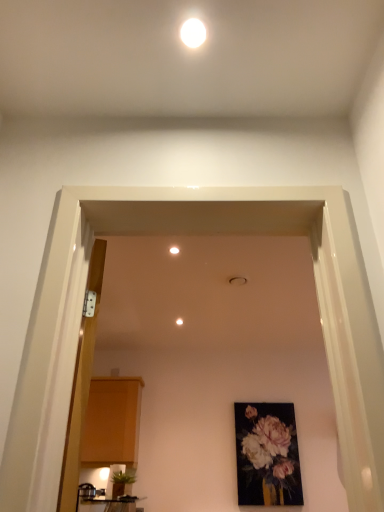
The width and height of the screenshot is (384, 512). Describe the element at coordinates (107, 504) in the screenshot. I see `matte black table at lower left` at that location.

Describe the element at coordinates (267, 455) in the screenshot. Image resolution: width=384 pixels, height=512 pixels. I see `matte floral painting at center` at that location.

Where is `white glossy light fixture at upper center, which is the 1th lighting from front to back`? The image size is (384, 512). white glossy light fixture at upper center, which is the 1th lighting from front to back is located at coordinates (193, 32).

From the picture: How different are the orientations of white matte ceiling light at center, the first lighting positioned from the left, and wooden door at left in degrees?

They differ by 69.7 degrees in their facing directions.

I want to click on door to the left of white matte ceiling light at center, the first lighting positioned from the left, so click(x=81, y=386).

Considering the sizes of white matte ceiling light at center, which appears as the second lighting when viewed from the right, and wooden door at left in the image, is white matte ceiling light at center, which appears as the second lighting when viewed from the right, bigger or smaller than wooden door at left?

white matte ceiling light at center, which appears as the second lighting when viewed from the right, is smaller than wooden door at left.

From a real-world perspective, which object stands above the other?

matte wood cabinet at left is physically above.

Identify the location of cabinetry that appears on the left of matte black table at lower left. The width and height of the screenshot is (384, 512). (112, 422).

Does matte black table at lower left have a smaller size compared to matte wood cabinet at left?

Correct, matte black table at lower left occupies less space than matte wood cabinet at left.

Is green leafy plant at lower left looking in the opposite direction of wooden door at left?

That's not correct — green leafy plant at lower left is not looking away from wooden door at left.

From the image's perspective, who appears lower, green leafy plant at lower left or wooden door at left?

From the image's view, green leafy plant at lower left is below.

In the scene shown: Who is taller, green leafy plant at lower left or wooden door at left?

wooden door at left is taller.

Visually, is green leafy plant at lower left positioned to the left or to the right of wooden door at left?

Based on their positions, green leafy plant at lower left is located to the right of wooden door at left.

From the picture: Is matte floral painting at center to the left of matte black table at lower left from the viewer's perspective?

Incorrect, matte floral painting at center is not on the left side of matte black table at lower left.

Is matte floral painting at center positioned beyond the bounds of matte black table at lower left?

Yes, matte floral painting at center is not within matte black table at lower left.

Between matte floral painting at center and matte black table at lower left, which one has less height?

matte black table at lower left is shorter.

Based on the photo, is matte wood cabinet at left facing away from green leafy plant at lower left?

No, matte wood cabinet at left is not facing the opposite direction of green leafy plant at lower left.

Considering the relative sizes of matte wood cabinet at left and green leafy plant at lower left in the image provided, is matte wood cabinet at left bigger than green leafy plant at lower left?

Correct, matte wood cabinet at left is larger in size than green leafy plant at lower left.

In the image, is matte wood cabinet at left on the left side or the right side of green leafy plant at lower left?

matte wood cabinet at left is to the left of green leafy plant at lower left.

Considering the relative sizes of matte wood cabinet at left and green leafy plant at lower left in the image provided, is matte wood cabinet at left shorter than green leafy plant at lower left?

No, matte wood cabinet at left is not shorter than green leafy plant at lower left.

Is white glossy light fixture at upper center, the 1th lighting viewed from the right, not within matte floral painting at center?

Yes.

Are white glossy light fixture at upper center, the second lighting from the back, and matte floral painting at center located far from each other?

Yes, white glossy light fixture at upper center, the second lighting from the back, is far from matte floral painting at center.

Considering the relative sizes of white glossy light fixture at upper center, which ranks as the 2th lighting in bottom-to-top order, and matte floral painting at center in the image provided, is white glossy light fixture at upper center, which ranks as the 2th lighting in bottom-to-top order, smaller than matte floral painting at center?

Indeed, white glossy light fixture at upper center, which ranks as the 2th lighting in bottom-to-top order, has a smaller size compared to matte floral painting at center.

From the image's perspective, does matte floral painting at center appear higher than white glossy light fixture at upper center, the second lighting from the back?

No, from the image's perspective, matte floral painting at center is not on top of white glossy light fixture at upper center, the second lighting from the back.

Between matte floral painting at center and white glossy light fixture at upper center, the second lighting from the back, which one appears on the left side from the viewer's perspective?

white glossy light fixture at upper center, the second lighting from the back.

Can you see matte floral painting at center touching white glossy light fixture at upper center, the second lighting from the back?

No, matte floral painting at center is not next to white glossy light fixture at upper center, the second lighting from the back.

I want to click on the 1st lighting counting from the right of the wooden door at left, so click(x=174, y=250).

What are the coordinates of `cabinetry located behind the matte black table at lower left` in the screenshot? It's located at click(x=112, y=422).

When comparing their distances from green leafy plant at lower left, does matte wood cabinet at left or matte floral painting at center seem closer?

matte wood cabinet at left is positioned closer to the anchor green leafy plant at lower left.

Looking at the image, which one is located closer to green leafy plant at lower left, white matte ceiling light at center, which ranks as the second lighting in top-to-bottom order, or wooden door at left?

The object closer to green leafy plant at lower left is wooden door at left.

Which object lies further to the anchor point matte floral painting at center, white glossy light fixture at upper center, which is the 1th lighting from front to back, or white matte ceiling light at center, which appears as the second lighting when viewed from the right?

white glossy light fixture at upper center, which is the 1th lighting from front to back, lies further to matte floral painting at center than the other object.

When comparing their distances from wooden door at left, does matte wood cabinet at left or matte black table at lower left seem closer?

matte wood cabinet at left is closer to wooden door at left.

When comparing their distances from white matte ceiling light at center, the first lighting positioned from the left, does green leafy plant at lower left or wooden door at left seem further?

green leafy plant at lower left.

From the image, which object appears to be nearer to matte black table at lower left, matte wood cabinet at left or white glossy light fixture at upper center, the second lighting from the back?

matte wood cabinet at left is closer to matte black table at lower left.

From the image, which object appears to be nearer to matte floral painting at center, green leafy plant at lower left or white matte ceiling light at center, which appears as the second lighting when viewed from the right?

green leafy plant at lower left is positioned closer to the anchor matte floral painting at center.

From the image, which object appears to be nearer to matte black table at lower left, green leafy plant at lower left or wooden door at left?

The object closer to matte black table at lower left is green leafy plant at lower left.

Where is `lighting between white glossy light fixture at upper center, the 1th lighting viewed from the right, and green leafy plant at lower left, in the vertical direction`? This screenshot has height=512, width=384. lighting between white glossy light fixture at upper center, the 1th lighting viewed from the right, and green leafy plant at lower left, in the vertical direction is located at coordinates (174, 250).

Locate an element on the screen. The width and height of the screenshot is (384, 512). cabinetry between white glossy light fixture at upper center, which ranks as the 1th lighting in top-to-bottom order, and matte black table at lower left from top to bottom is located at coordinates (112, 422).

I want to click on table between white matte ceiling light at center, the 2th lighting positioned from the front, and matte floral painting at center, in the vertical direction, so click(107, 504).

Identify the location of lighting between white glossy light fixture at upper center, which is the 1th lighting from front to back, and matte floral painting at center, in the vertical direction. (174, 250).